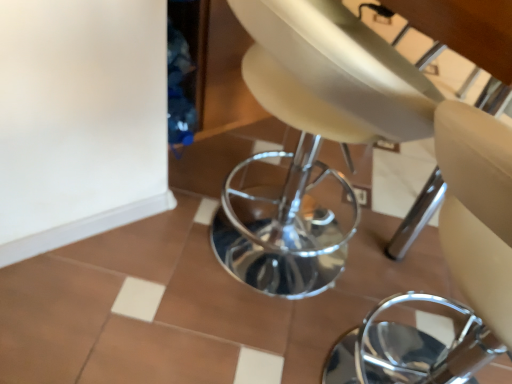
Question: Does beige leather chair at center have a greater width compared to white glossy tile at lower left?

Choices:
 (A) yes
 (B) no

Answer: (A)

Question: Is white glossy tile at lower left at the back of beige leather chair at center?

Choices:
 (A) no
 (B) yes

Answer: (A)

Question: Does beige leather chair at center appear on the right side of white glossy tile at lower left?

Choices:
 (A) yes
 (B) no

Answer: (A)

Question: Is beige leather chair at center to the left of white glossy tile at lower left from the viewer's perspective?

Choices:
 (A) yes
 (B) no

Answer: (B)

Question: Considering the relative sizes of beige leather chair at center and white glossy tile at lower left in the image provided, is beige leather chair at center shorter than white glossy tile at lower left?

Choices:
 (A) yes
 (B) no

Answer: (B)

Question: From the image's perspective, is white glossy tile at lower left above or below beige leather chair at center?

Choices:
 (A) below
 (B) above

Answer: (B)

Question: In terms of height, does white glossy tile at lower left look taller or shorter compared to beige leather chair at center?

Choices:
 (A) short
 (B) tall

Answer: (A)

Question: From a real-world perspective, relative to beige leather chair at center, is white glossy tile at lower left vertically above or below?

Choices:
 (A) below
 (B) above

Answer: (A)

Question: Is white glossy tile at lower left spatially inside beige leather chair at center, or outside of it?

Choices:
 (A) inside
 (B) outside

Answer: (B)

Question: Is point (182, 228) closer or farther from the camera than point (416, 79)?

Choices:
 (A) farther
 (B) closer

Answer: (A)

Question: Looking at the image, does white glossy tile at lower left seem bigger or smaller compared to beige leather swivel chair at center?

Choices:
 (A) big
 (B) small

Answer: (B)

Question: From the image's perspective, relative to beige leather swivel chair at center, is white glossy tile at lower left above or below?

Choices:
 (A) above
 (B) below

Answer: (B)

Question: Considering the positions of white glossy tile at lower left and beige leather swivel chair at center in the image, is white glossy tile at lower left taller or shorter than beige leather swivel chair at center?

Choices:
 (A) short
 (B) tall

Answer: (A)

Question: Is beige leather chair at center to the left or to the right of white glossy tile at lower left in the image?

Choices:
 (A) left
 (B) right

Answer: (B)

Question: Considering the positions of beige leather chair at center and white glossy tile at lower left in the image, is beige leather chair at center wider or thinner than white glossy tile at lower left?

Choices:
 (A) wide
 (B) thin

Answer: (A)